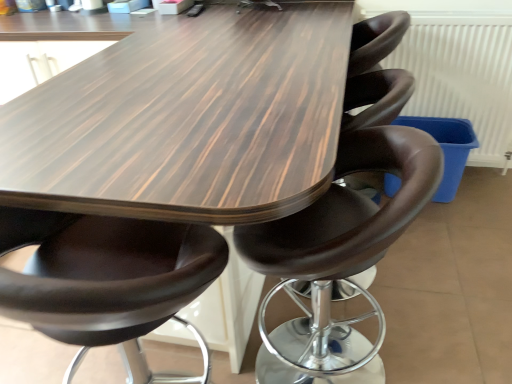
What do you see at coordinates (106, 278) in the screenshot? I see `matte brown leather chair at center, which is the second chair from right to left` at bounding box center [106, 278].

What do you see at coordinates (185, 127) in the screenshot? This screenshot has height=384, width=512. I see `wooden table at center` at bounding box center [185, 127].

Find the location of a particular element. The height and width of the screenshot is (384, 512). matte brown leather chair at center, the first chair viewed from the left is located at coordinates (106, 278).

Is white textured radiator at upper right at the back of matte brown leather chair at center, which is the second chair from right to left?

matte brown leather chair at center, which is the second chair from right to left, is not turned away from white textured radiator at upper right.

How much distance is there between matte brown leather chair at center, which is the second chair from right to left, and white textured radiator at upper right?

matte brown leather chair at center, which is the second chair from right to left, is 5.89 feet from white textured radiator at upper right.

You are a GUI agent. You are given a task and a screenshot of the screen. Output one action in this format:
    pyautogui.click(x=<x>, y=<y>)
    Task: Click on the 2nd chair below the white textured radiator at upper right (from the image's perspective)
    This screenshot has height=384, width=512.
    Given the screenshot: What is the action you would take?
    pyautogui.click(x=106, y=278)

Which is behind, matte brown leather chair at center, the first chair viewed from the left, or white textured radiator at upper right?

white textured radiator at upper right is further from the camera.

Can we say wooden table at center lies outside brown leather stool at center, which ranks as the 1th chair in right-to-left order?

That's correct, wooden table at center is outside of brown leather stool at center, which ranks as the 1th chair in right-to-left order.

Is point (82, 160) more distant than point (263, 225)?

No, it is not.

From the image's perspective, who appears lower, wooden table at center or brown leather stool at center, acting as the 2th chair starting from the left?

brown leather stool at center, acting as the 2th chair starting from the left, appears lower in the image.

At what (x,y) coordinates should I click in order to perform the action: click on chair lying on the right of wooden table at center. Please return your answer as a coordinate pair (x, y). This screenshot has width=512, height=384. Looking at the image, I should click on (338, 257).

Which is less distant, (493, 166) or (166, 44)?

Point (493, 166) is farther from the camera than point (166, 44).

Can you confirm if white textured radiator at upper right is positioned to the left of wooden table at center?

In fact, white textured radiator at upper right is to the right of wooden table at center.

From a real-world perspective, which object stands above the other?

From a 3D spatial view, white textured radiator at upper right is above.

Would you say white textured radiator at upper right contains wooden table at center?

No, wooden table at center is not a part of white textured radiator at upper right.

Is point (170, 381) positioned before point (9, 151)?

No, (170, 381) is behind (9, 151).

From the image's perspective, is matte brown leather chair at center, the first chair viewed from the left, on wooden table at center?

Incorrect, from the image's perspective, matte brown leather chair at center, the first chair viewed from the left, is lower than wooden table at center.

Looking at their sizes, would you say matte brown leather chair at center, which is the second chair from right to left, is wider or thinner than wooden table at center?

In the image, matte brown leather chair at center, which is the second chair from right to left, appears to be more narrow than wooden table at center.

Considering the relative sizes of matte brown leather chair at center, the first chair viewed from the left, and wooden table at center in the image provided, is matte brown leather chair at center, the first chair viewed from the left, smaller than wooden table at center?

Correct, matte brown leather chair at center, the first chair viewed from the left, occupies less space than wooden table at center.

Does wooden table at center have a larger size compared to matte brown leather chair at center, which is the second chair from right to left?

Indeed, wooden table at center has a larger size compared to matte brown leather chair at center, which is the second chair from right to left.

Is wooden table at center beside matte brown leather chair at center, the first chair viewed from the left?

wooden table at center and matte brown leather chair at center, the first chair viewed from the left, are not in contact.

Is wooden table at center inside or outside of matte brown leather chair at center, the first chair viewed from the left?

wooden table at center is spatially situated outside matte brown leather chair at center, the first chair viewed from the left.

From the image's perspective, which one is positioned higher, wooden table at center or matte brown leather chair at center, the first chair viewed from the left?

wooden table at center.

Is white textured radiator at upper right taller or shorter than matte brown leather chair at center, the first chair viewed from the left?

Considering their sizes, white textured radiator at upper right has less height than matte brown leather chair at center, the first chair viewed from the left.

Is white textured radiator at upper right positioned behind matte brown leather chair at center, which is the second chair from right to left?

Yes.

Is white textured radiator at upper right with matte brown leather chair at center, which is the second chair from right to left?

No, white textured radiator at upper right is not next to matte brown leather chair at center, which is the second chair from right to left.

Is point (85, 241) closer or farther from the camera than point (297, 280)?

Point (85, 241) appears to be closer to the viewer than point (297, 280).

Based on the photo, can you confirm if matte brown leather chair at center, the first chair viewed from the left, is positioned to the left of brown leather stool at center, acting as the 2th chair starting from the left?

Yes, matte brown leather chair at center, the first chair viewed from the left, is to the left of brown leather stool at center, acting as the 2th chair starting from the left.

Which object is closer to the camera taking this photo, matte brown leather chair at center, which is the second chair from right to left, or brown leather stool at center, acting as the 2th chair starting from the left?

matte brown leather chair at center, which is the second chair from right to left.

Is matte brown leather chair at center, which is the second chair from right to left, not near brown leather stool at center, acting as the 2th chair starting from the left?

matte brown leather chair at center, which is the second chair from right to left, is actually quite close to brown leather stool at center, acting as the 2th chair starting from the left.

From the white textured radiator at upper right, count the 2nd chair to the left and point to it. Please provide its 2D coordinates.

[(106, 278)]

Where is `chair on the right of wooden table at center`? This screenshot has width=512, height=384. chair on the right of wooden table at center is located at coordinates (338, 257).

When comparing their distances from matte brown leather chair at center, the first chair viewed from the left, does wooden table at center or brown leather stool at center, acting as the 2th chair starting from the left, seem closer?

wooden table at center is closer to matte brown leather chair at center, the first chair viewed from the left.

Estimate the real-world distances between objects in this image. Which object is further from wooden table at center, matte brown leather chair at center, which is the second chair from right to left, or white textured radiator at upper right?

white textured radiator at upper right lies further to wooden table at center than the other object.

From the image, which object appears to be nearer to brown leather stool at center, acting as the 2th chair starting from the left, white textured radiator at upper right or wooden table at center?

wooden table at center.

Based on their spatial positions, is matte brown leather chair at center, which is the second chair from right to left, or wooden table at center closer to brown leather stool at center, acting as the 2th chair starting from the left?

matte brown leather chair at center, which is the second chair from right to left, is closer to brown leather stool at center, acting as the 2th chair starting from the left.

Considering their positions, is white textured radiator at upper right positioned further to wooden table at center than brown leather stool at center, acting as the 2th chair starting from the left?

white textured radiator at upper right.

Estimate the real-world distances between objects in this image. Which object is further from brown leather stool at center, which ranks as the 1th chair in right-to-left order, matte brown leather chair at center, which is the second chair from right to left, or white textured radiator at upper right?

white textured radiator at upper right lies further to brown leather stool at center, which ranks as the 1th chair in right-to-left order, than the other object.

Based on their spatial positions, is brown leather stool at center, acting as the 2th chair starting from the left, or wooden table at center further from white textured radiator at upper right?

Among the two, brown leather stool at center, acting as the 2th chair starting from the left, is located further to white textured radiator at upper right.

Based on their spatial positions, is brown leather stool at center, which ranks as the 1th chair in right-to-left order, or matte brown leather chair at center, the first chair viewed from the left, further from wooden table at center?

Among the two, brown leather stool at center, which ranks as the 1th chair in right-to-left order, is located further to wooden table at center.

Where is `table situated between matte brown leather chair at center, which is the second chair from right to left, and brown leather stool at center, which ranks as the 1th chair in right-to-left order, from left to right`? Image resolution: width=512 pixels, height=384 pixels. table situated between matte brown leather chair at center, which is the second chair from right to left, and brown leather stool at center, which ranks as the 1th chair in right-to-left order, from left to right is located at coordinates (185, 127).

The image size is (512, 384). What are the coordinates of `table between matte brown leather chair at center, the first chair viewed from the left, and white textured radiator at upper right in the front-back direction` in the screenshot? It's located at (185, 127).

The image size is (512, 384). In order to click on chair between matte brown leather chair at center, the first chair viewed from the left, and white textured radiator at upper right, along the z-axis in this screenshot , I will do `click(338, 257)`.

Locate an element on the screen. chair positioned between wooden table at center and white textured radiator at upper right from near to far is located at coordinates (338, 257).